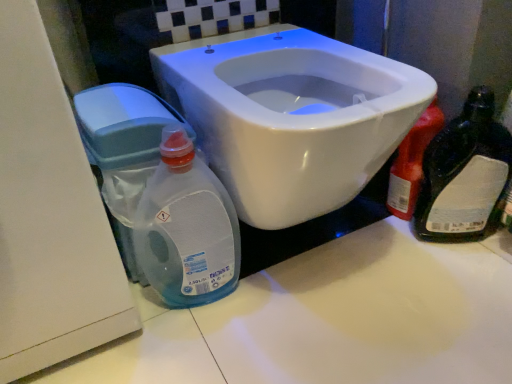
Question: Should I look upward or downward to see translucent plastic bottle at right?

Choices:
 (A) up
 (B) down

Answer: (A)

Question: From a real-world perspective, is translucent plastic bottle at right on white glossy toilet at center?

Choices:
 (A) yes
 (B) no

Answer: (B)

Question: Considering the relative sizes of translucent plastic bottle at right and white glossy toilet at center in the image provided, is translucent plastic bottle at right shorter than white glossy toilet at center?

Choices:
 (A) no
 (B) yes

Answer: (B)

Question: Considering the relative sizes of translucent plastic bottle at right and white glossy toilet at center in the image provided, is translucent plastic bottle at right smaller than white glossy toilet at center?

Choices:
 (A) no
 (B) yes

Answer: (B)

Question: Considering the relative sizes of translucent plastic bottle at right and white glossy toilet at center in the image provided, is translucent plastic bottle at right thinner than white glossy toilet at center?

Choices:
 (A) yes
 (B) no

Answer: (A)

Question: Is white glossy toilet at center at the back of translucent plastic bottle at right?

Choices:
 (A) no
 (B) yes

Answer: (A)

Question: Is translucent plastic bottle at right to the right of white glossy toilet at center from the viewer's perspective?

Choices:
 (A) yes
 (B) no

Answer: (A)

Question: Is transparent plastic bottle at lower left aimed at translucent plastic bottle at right?

Choices:
 (A) no
 (B) yes

Answer: (A)

Question: Considering the relative positions of transparent plastic bottle at lower left and translucent plastic bottle at right in the image provided, is transparent plastic bottle at lower left behind translucent plastic bottle at right?

Choices:
 (A) yes
 (B) no

Answer: (B)

Question: Considering the relative sizes of transparent plastic bottle at lower left and translucent plastic bottle at right in the image provided, is transparent plastic bottle at lower left taller than translucent plastic bottle at right?

Choices:
 (A) no
 (B) yes

Answer: (B)

Question: Considering the relative positions of transparent plastic bottle at lower left and translucent plastic bottle at right in the image provided, is transparent plastic bottle at lower left to the left of translucent plastic bottle at right from the viewer's perspective?

Choices:
 (A) yes
 (B) no

Answer: (A)

Question: Would you say transparent plastic bottle at lower left is a long distance from translucent plastic bottle at right?

Choices:
 (A) yes
 (B) no

Answer: (B)

Question: Is transparent plastic bottle at lower left wider than translucent plastic bottle at right?

Choices:
 (A) no
 (B) yes

Answer: (B)

Question: From a real-world perspective, is white glossy toilet at center physically below translucent plastic bottle at right?

Choices:
 (A) yes
 (B) no

Answer: (B)